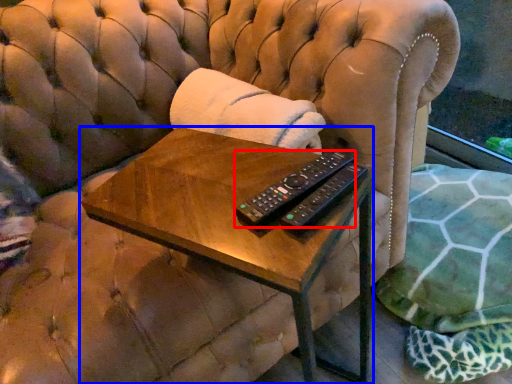
Question: Which of the following is the closest to the observer, remote control (highlighted by a red box) or table (highlighted by a blue box)?

Choices:
 (A) remote control
 (B) table

Answer: (B)